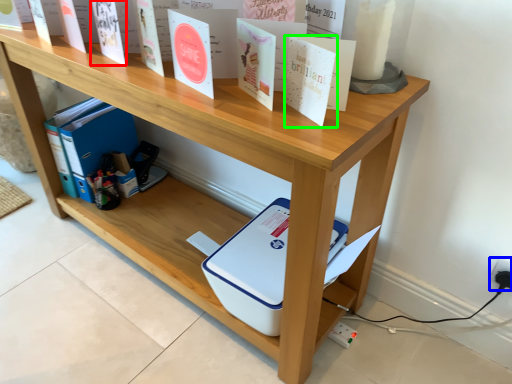
Question: Considering the real-world distances, which object is closest to paperback book (highlighted by a red box)? electric outlet (highlighted by a blue box) or paperback book (highlighted by a green box).

Choices:
 (A) electric outlet
 (B) paperback book

Answer: (B)